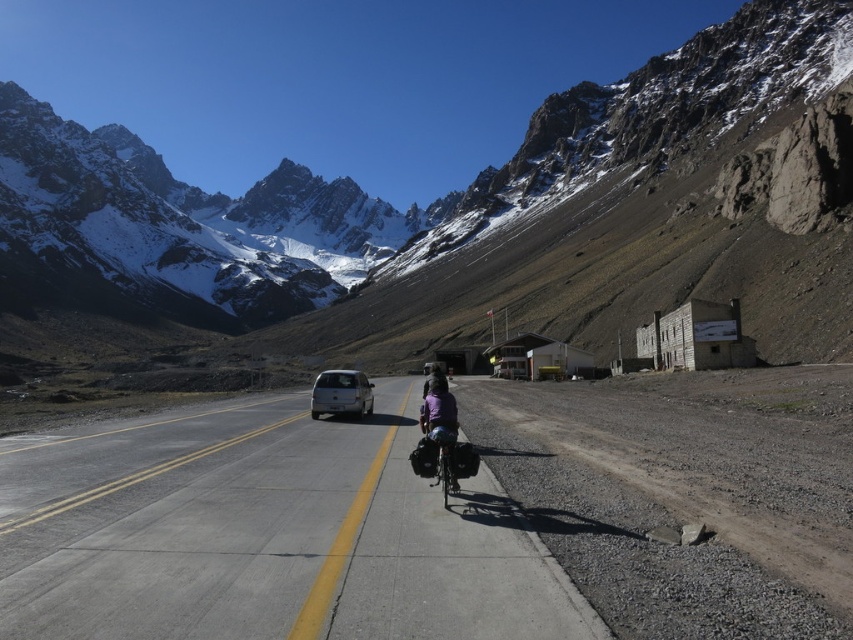
You are a drone operator trying to capture an aerial shot of the mountain road. You have two points marked on your map, point 1 at coordinates point (264,196) and point 2 at coordinates point (338,372). If you want to fly the drone closer to the camera position, which point should you choose?

Point 1 at coordinates point (264,196) is further to the camera than point (338,372), so to fly closer to the camera position, you should choose point 1 at coordinates point (264,196).

What is the spatial relationship between the snowy rocky mountain range at upper center and the small building to the right of the road?

The snowy rocky mountain range at upper center is positioned at point coordinates (x=476, y=204), but the exact location of the small building isn not provided in the description. Therefore, the relationship cannot be determined precisely without additional information.